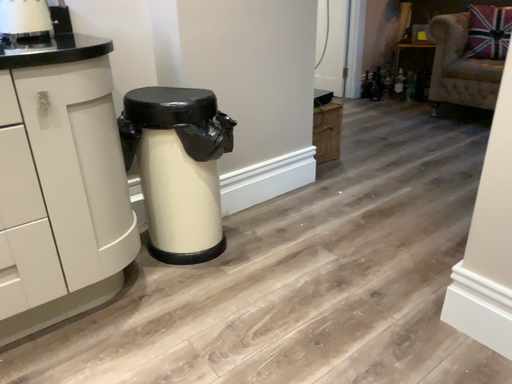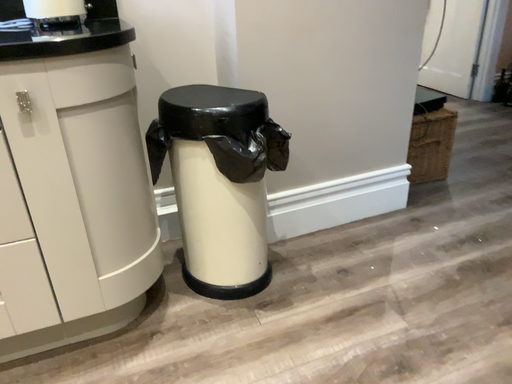
Question: How did the camera likely rotate when shooting the video?

Choices:
 (A) rotated right
 (B) rotated left

Answer: (B)